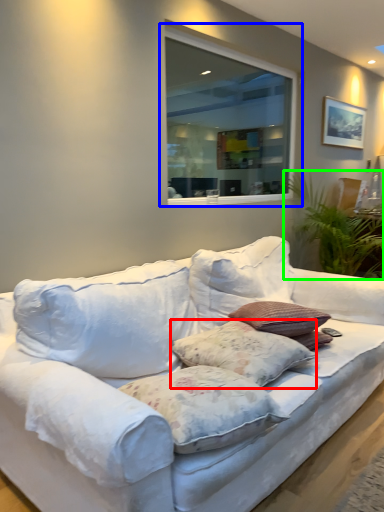
Question: Considering the real-world distances, which object is farthest from pillow (highlighted by a red box)? window (highlighted by a blue box) or plant (highlighted by a green box)?

Choices:
 (A) window
 (B) plant

Answer: (A)